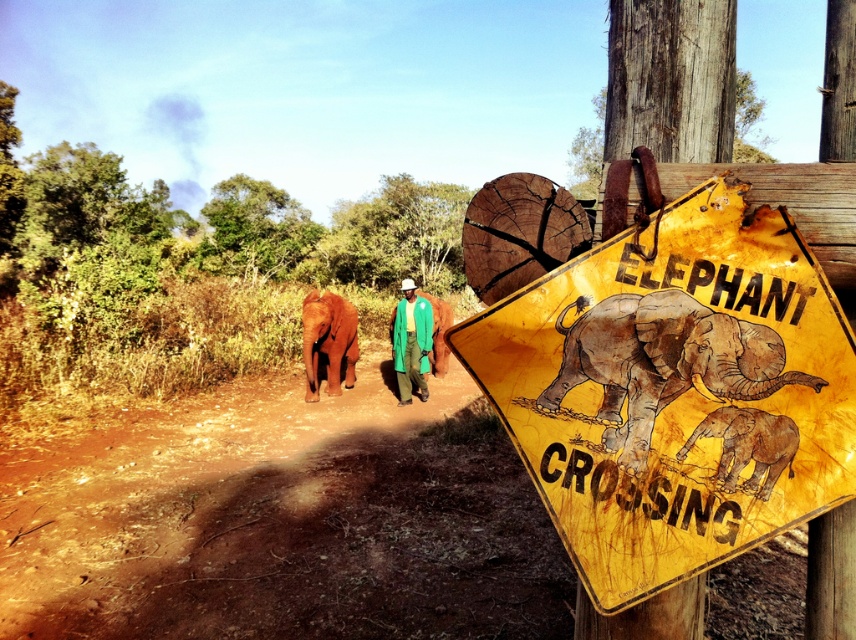
Is brown textured baby elephant at lower right wider than orange smooth elephant at lower left?

No.

Who is positioned more to the right, brown textured baby elephant at lower right or orange smooth elephant at lower left?

brown textured baby elephant at lower right

This screenshot has height=640, width=856. What do you see at coordinates (749, 445) in the screenshot?
I see `brown textured baby elephant at lower right` at bounding box center [749, 445].

This screenshot has height=640, width=856. Identify the location of brown textured baby elephant at lower right. (749, 445).

Is yellow rusted metal sign at upper right shorter than green fabric jacket at center?

In fact, yellow rusted metal sign at upper right may be taller than green fabric jacket at center.

Is yellow rusted metal sign at upper right in front of green fabric jacket at center?

Yes, it is in front of green fabric jacket at center.

Locate an element on the screen. yellow rusted metal sign at upper right is located at coordinates (675, 392).

Is yellow rusted metal sign at upper right positioned in front of orange smooth elephant at lower left?

Yes, it is.

Between point (717, 442) and point (314, 316), which one is positioned behind?

The point (314, 316) is more distant.

At what (x,y) coordinates should I click in order to perform the action: click on yellow rusted metal sign at upper right. Please return your answer as a coordinate pair (x, y). Looking at the image, I should click on (675, 392).